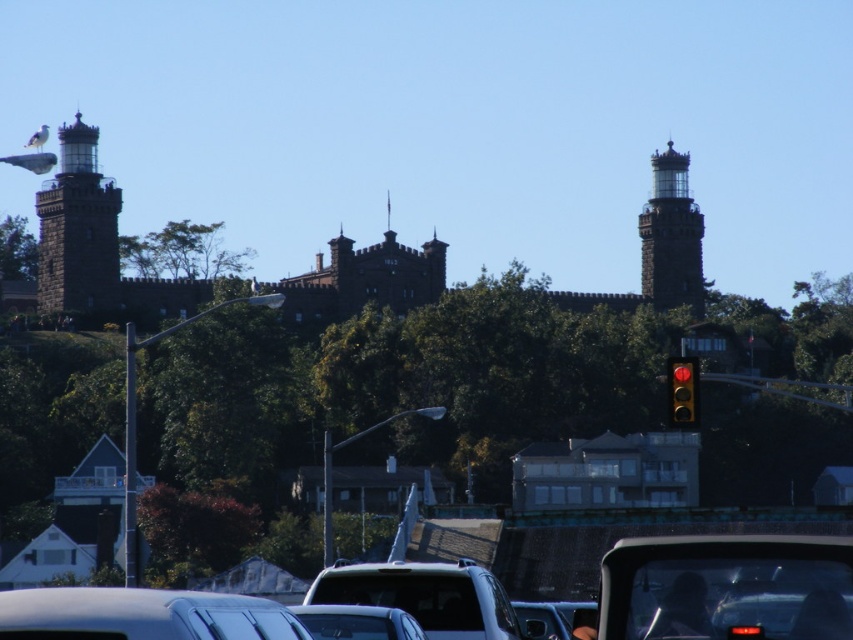
Is metallic silver car at lower left above dark gray stone tower at upper right?

Actually, metallic silver car at lower left is below dark gray stone tower at upper right.

Who is higher up, metallic silver car at lower left or dark gray stone tower at upper right?

Positioned higher is dark gray stone tower at upper right.

Which is behind, point (172, 616) or point (660, 193)?

The point (660, 193) is more distant.

Image resolution: width=853 pixels, height=640 pixels. In order to click on metallic silver car at lower left in this screenshot , I will do `click(142, 614)`.

The width and height of the screenshot is (853, 640). Describe the element at coordinates (142, 614) in the screenshot. I see `metallic silver car at lower left` at that location.

Does metallic silver car at lower left appear on the right side of satin black suv at center?

In fact, metallic silver car at lower left is to the left of satin black suv at center.

Where is `metallic silver car at lower left`? The height and width of the screenshot is (640, 853). metallic silver car at lower left is located at coordinates (142, 614).

Is clear glass car at center above metallic silver car at center?

Correct, clear glass car at center is located above metallic silver car at center.

Who is higher up, clear glass car at center or metallic silver car at center?

clear glass car at center is above.

At what (x,y) coordinates should I click in order to perform the action: click on clear glass car at center. Please return your answer as a coordinate pair (x, y). The width and height of the screenshot is (853, 640). Looking at the image, I should click on (727, 588).

Locate an element on the screen. clear glass car at center is located at coordinates pos(727,588).